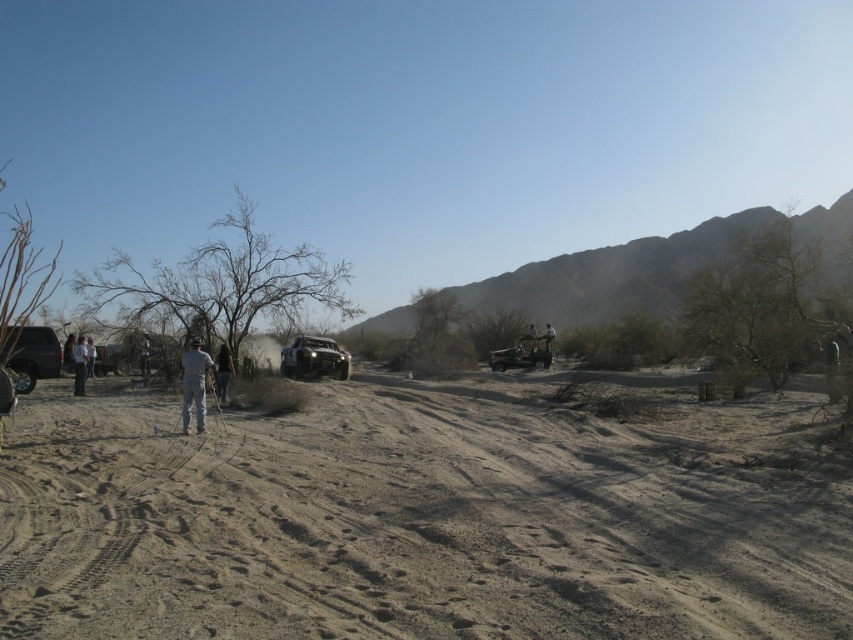
You are planning to park your car next to the metallic silver jeep at center and the gray fabric pants at left. Which of the two objects will require more space for parking?

The gray fabric pants at left requires more space for parking because its width is greater than the metallic silver jeep at center.